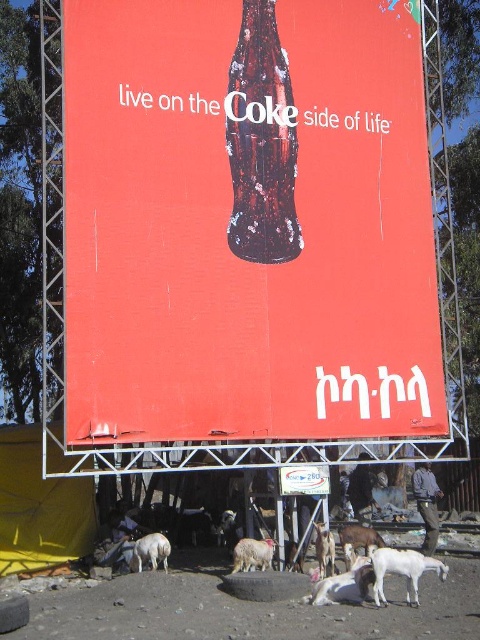
Between point (320, 280) and point (322, 573), which one is positioned behind?

Positioned behind is point (320, 280).

Does glass coca-cola bottle at center come in front of white woolen goat at center?

Yes, it is.

Who is more distant from viewer, [283,344] or [331,536]?

The point [331,536] is more distant.

At what (x,y) coordinates should I click in order to perform the action: click on glass coca-cola bottle at center. Please return your answer as a coordinate pair (x, y). The height and width of the screenshot is (640, 480). Looking at the image, I should click on (248, 221).

Between white woolen sheep at lower center and white woolen sheep at lower left, which one appears on the left side from the viewer's perspective?

white woolen sheep at lower left is more to the left.

Where is `white woolen sheep at lower center`? The image size is (480, 640). white woolen sheep at lower center is located at coordinates (252, 554).

How far apart are glass coca-cola bottle at center and white woolen sheep at lower center?

glass coca-cola bottle at center and white woolen sheep at lower center are 22.42 meters apart from each other.

Does glass coca-cola bottle at center appear on the left side of white woolen sheep at lower center?

In fact, glass coca-cola bottle at center is to the right of white woolen sheep at lower center.

I want to click on glass coca-cola bottle at center, so click(248, 221).

Image resolution: width=480 pixels, height=640 pixels. Identify the location of glass coca-cola bottle at center. (248, 221).